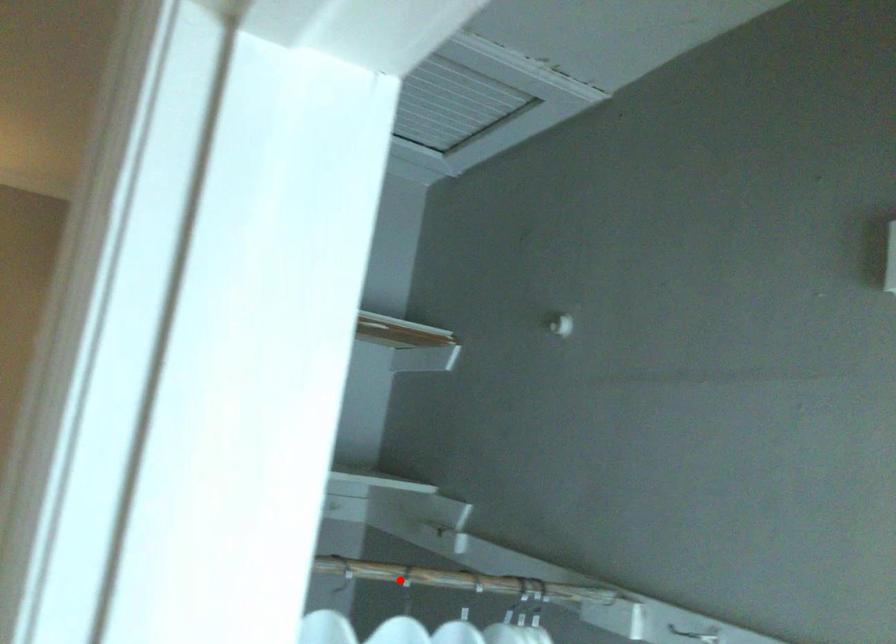
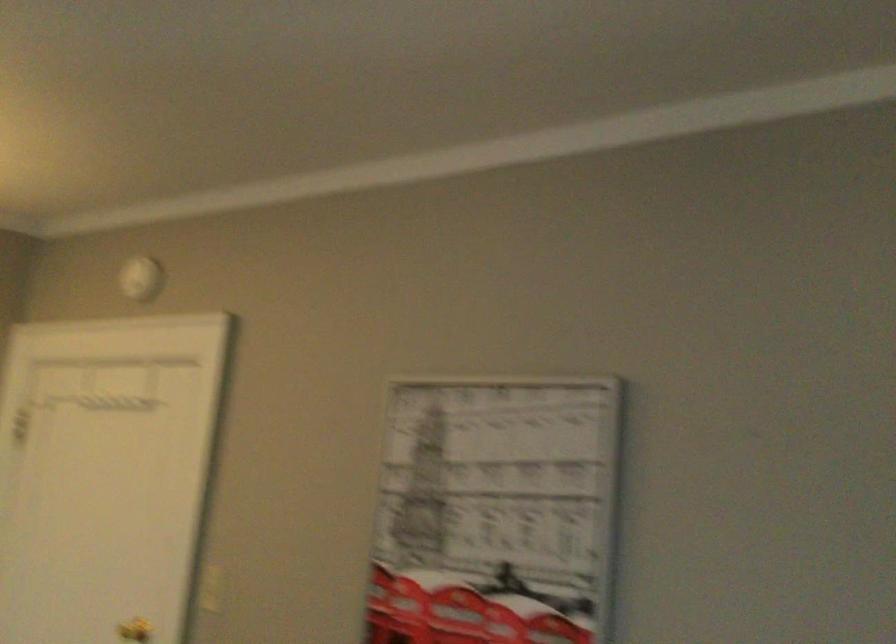
Question: I am providing you with two images of the same scene from different viewpoints. A red point is marked on the first image. Is the red point's position out of view in image 2?

Choices:
 (A) Yes
 (B) No

Answer: (A)